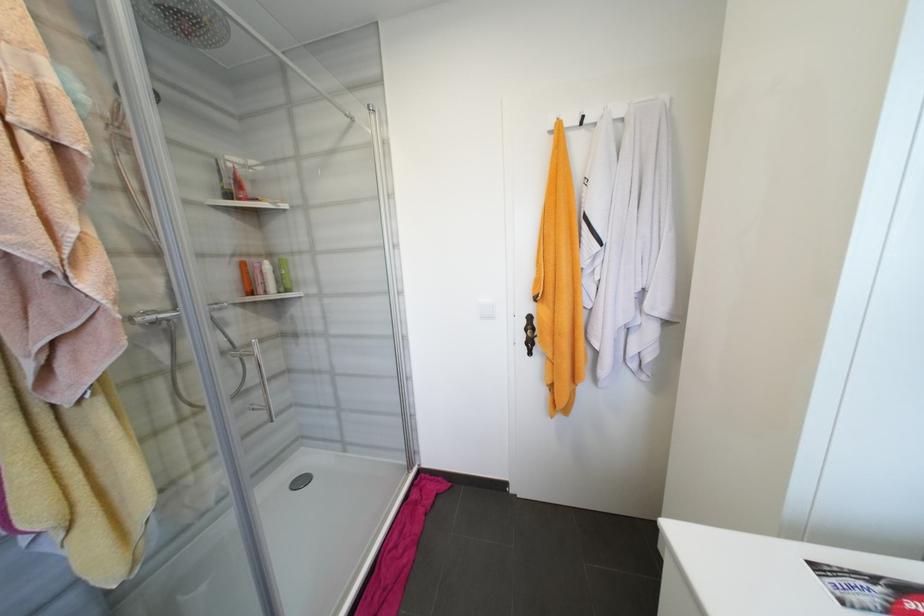
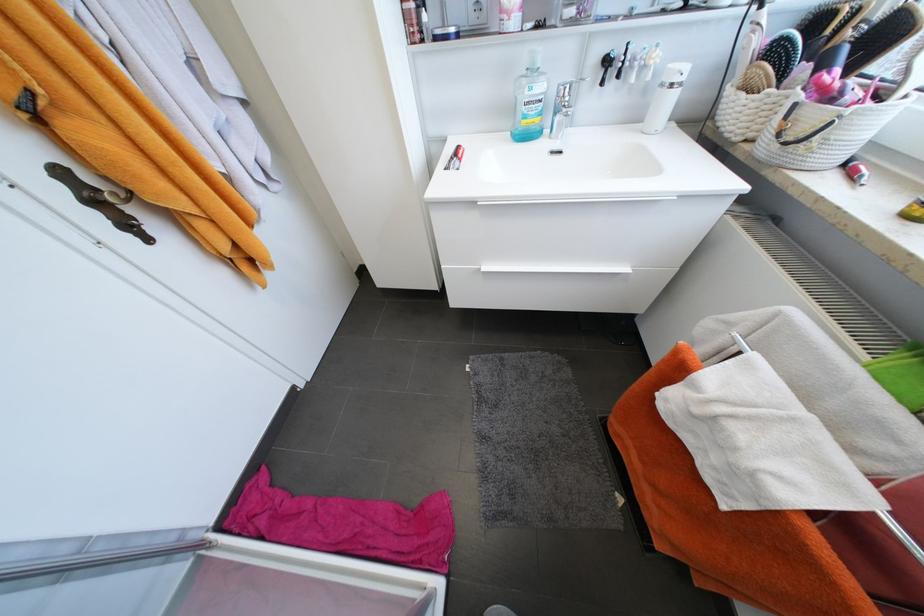
Where in the second image is the point corresponding to (x=536, y=345) from the first image?

(132, 225)